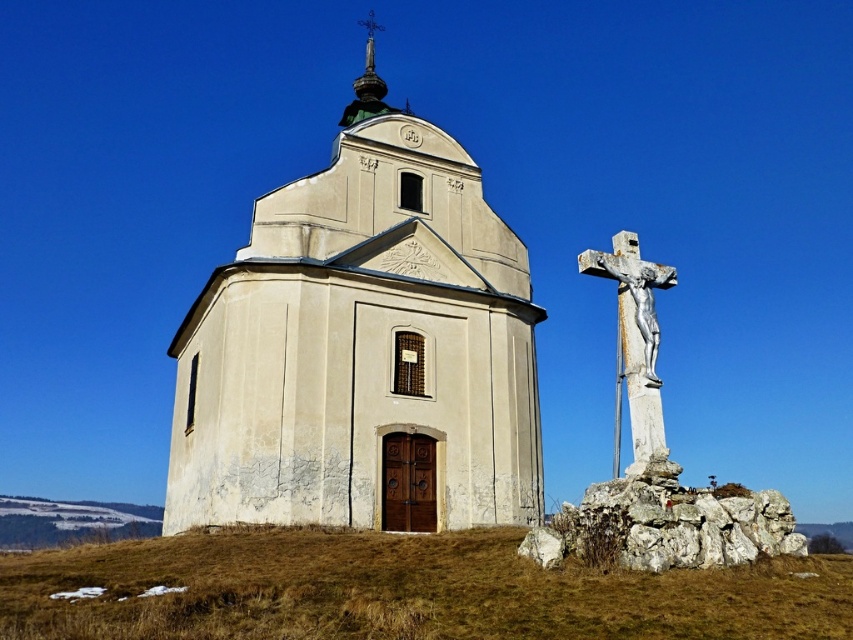
Which is behind, point (718, 595) or point (625, 301)?

Positioned behind is point (625, 301).

Between point (154, 596) and point (654, 349), which one is positioned in front?

Positioned in front is point (154, 596).

Find the location of `brown dry grass at lower center`. brown dry grass at lower center is located at coordinates (403, 589).

Is beige stone church at center shorter than white stone crucifix at right?

In fact, beige stone church at center may be taller than white stone crucifix at right.

Consider the image. Does beige stone church at center have a smaller size compared to white stone crucifix at right?

No.

What are the coordinates of `beige stone church at center` in the screenshot? It's located at (363, 348).

From the picture: Does beige stone church at center appear over brown dry grass at lower center?

Yes, beige stone church at center is above brown dry grass at lower center.

Between point (288, 244) and point (19, 570), which one is positioned behind?

The point (288, 244) is behind.

In order to click on beige stone church at center in this screenshot , I will do `click(363, 348)`.